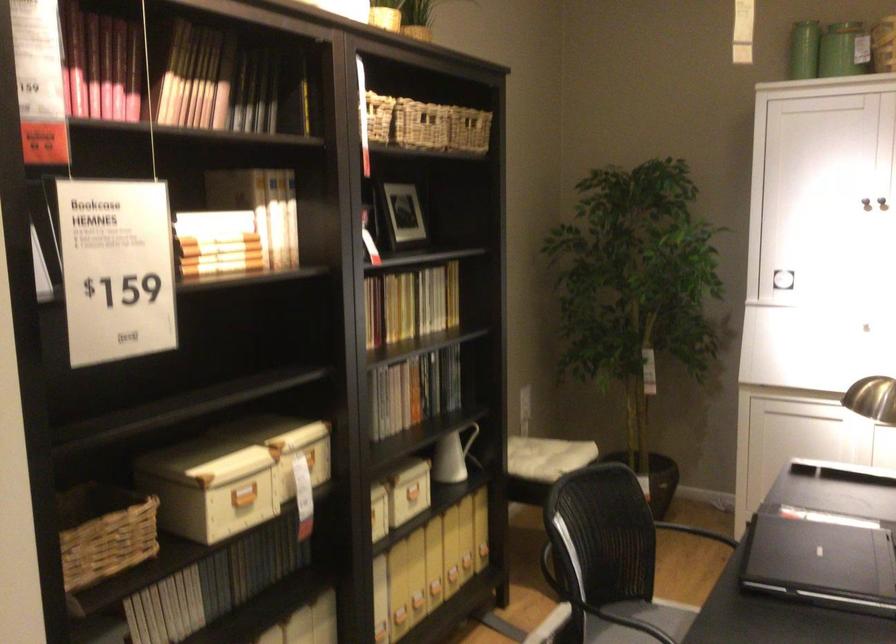
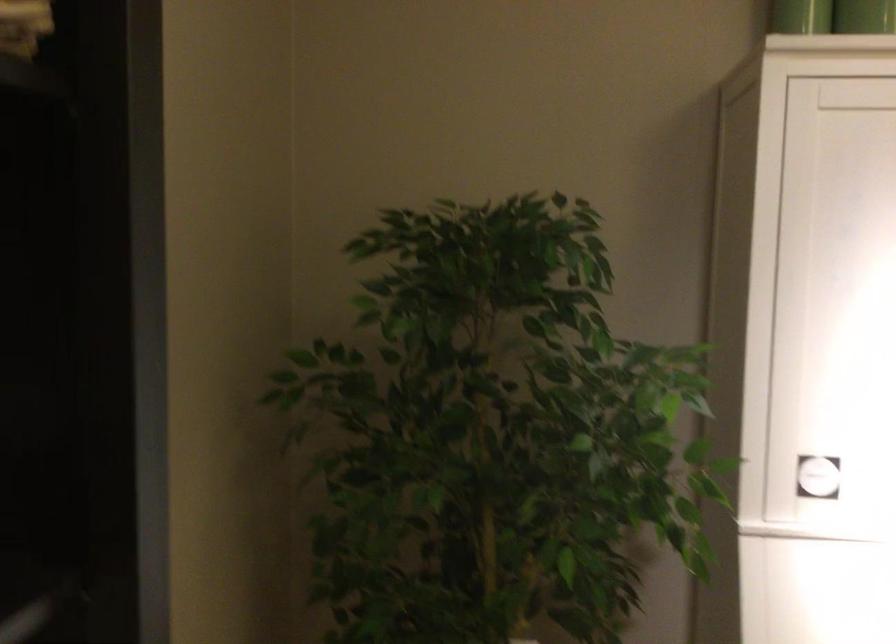
Question: What movement of the cameraman would produce the second image?

Choices:
 (A) Left
 (B) Right
 (C) Forward
 (D) Backward

Answer: (C)